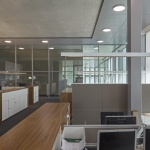
You are a GUI agent. You are given a task and a screenshot of the screen. Output one action in this format:
    pyautogui.click(x=<x>, y=<y>)
    Task: Click on the brown table top
    
    Given the screenshot: What is the action you would take?
    pyautogui.click(x=47, y=115)